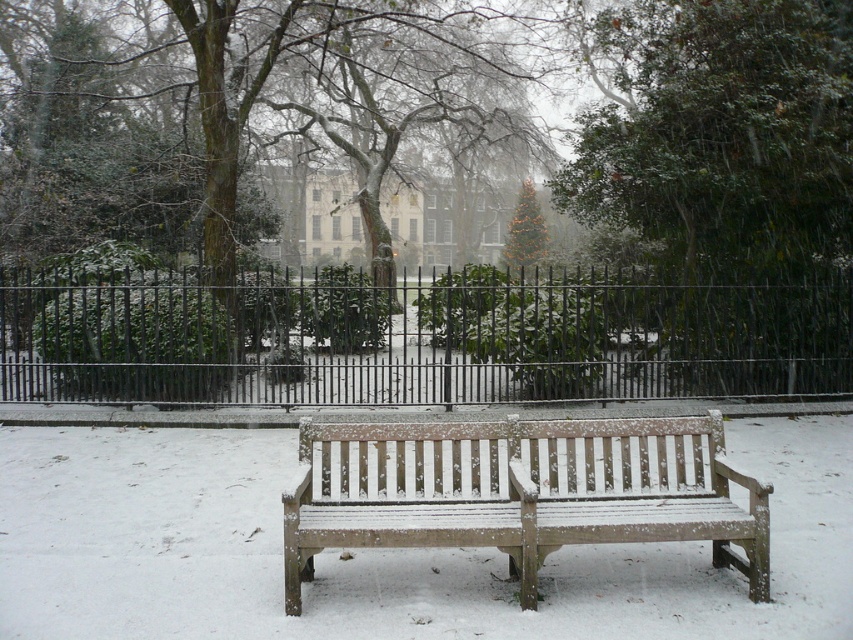
Can you confirm if black metal fence at center is wider than snow-covered wood bench at center?

Correct, the width of black metal fence at center exceeds that of snow-covered wood bench at center.

This screenshot has height=640, width=853. What do you see at coordinates (413, 339) in the screenshot?
I see `black metal fence at center` at bounding box center [413, 339].

At what (x,y) coordinates should I click in order to perform the action: click on black metal fence at center. Please return your answer as a coordinate pair (x, y). Looking at the image, I should click on (413, 339).

Does black metal fence at center appear under green leafy tree at center?

Indeed, black metal fence at center is positioned under green leafy tree at center.

Is point (672, 365) farther from viewer compared to point (630, 65)?

No.

Where is `black metal fence at center`? Image resolution: width=853 pixels, height=640 pixels. black metal fence at center is located at coordinates (413, 339).

Can you confirm if green leafy tree at center is positioned to the right of snow-covered wood bench at center?

Indeed, green leafy tree at center is positioned on the right side of snow-covered wood bench at center.

Does point (706, 353) come in front of point (693, 483)?

That is False.

Which is behind, point (666, 244) or point (503, 456)?

The point (666, 244) is behind.

The height and width of the screenshot is (640, 853). I want to click on green leafy tree at center, so click(x=721, y=138).